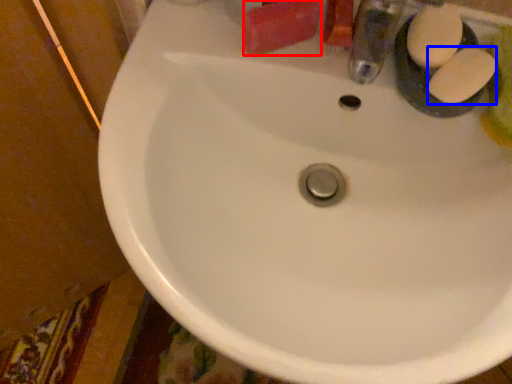
Question: Which of the following is the farthest to the observer, soap (highlighted by a red box) or soap (highlighted by a blue box)?

Choices:
 (A) soap
 (B) soap

Answer: (A)